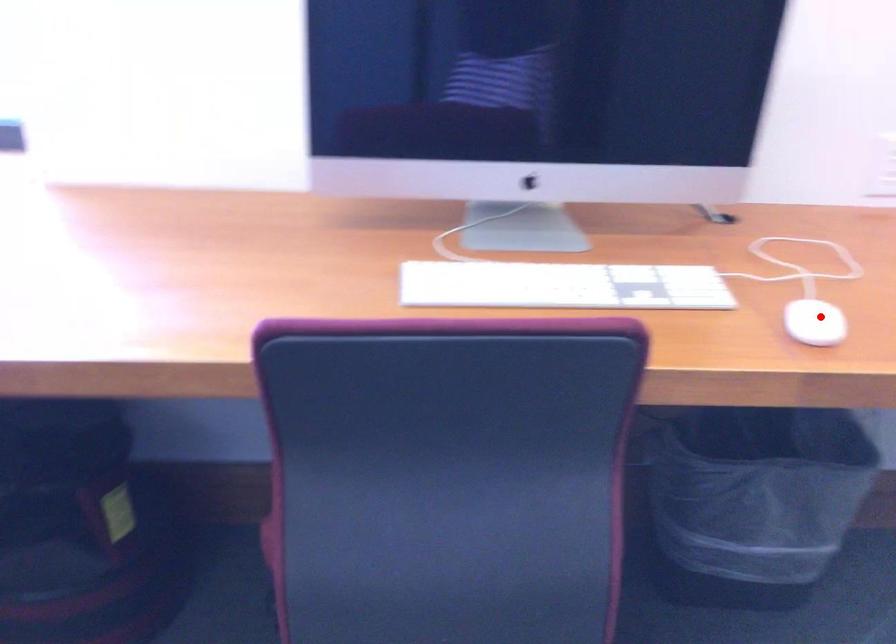
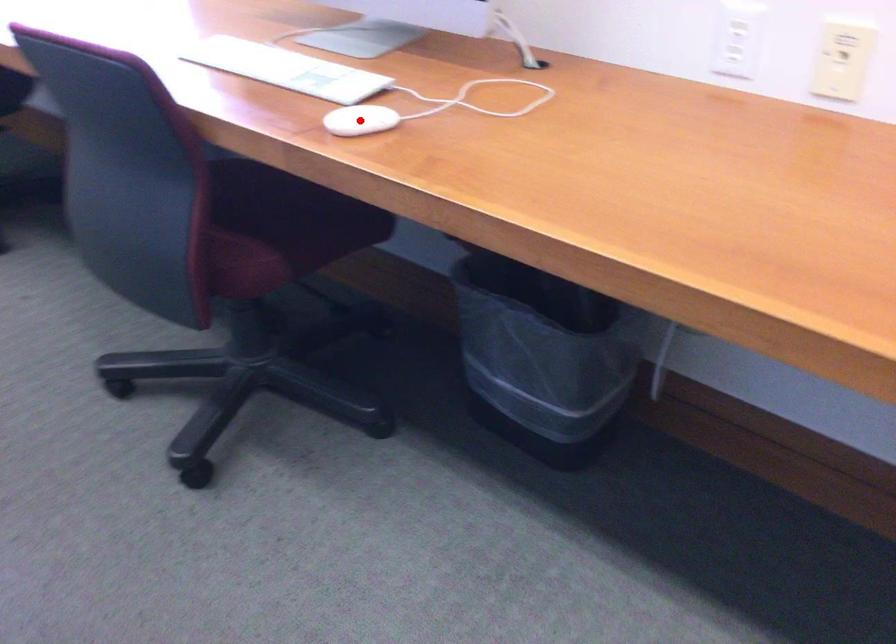
From the picture: I am providing you with two images of the same scene from different viewpoints. A red point is marked on the first image and another point is marked on the second image. Are the points marked in image1 and image2 representing the same 3D position?

Yes